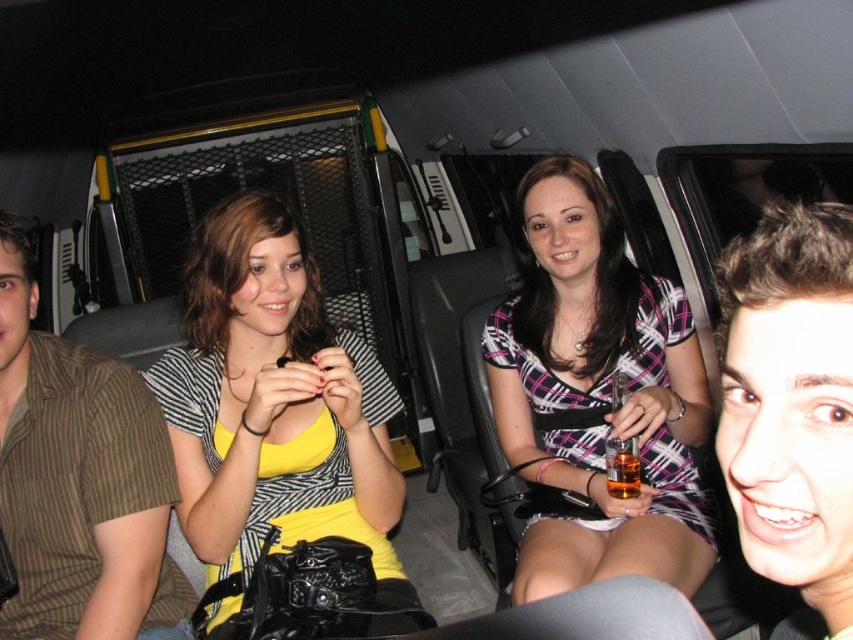
Question: Does plaid fabric dress at center have a lesser width compared to brown striped shirt at left?

Choices:
 (A) yes
 (B) no

Answer: (B)

Question: Which point is farther to the camera?

Choices:
 (A) (697, 529)
 (B) (631, 497)
 (C) (207, 497)

Answer: (A)

Question: Is brown striped shirt at left further to the viewer compared to translucent amber liquid at lower right?

Choices:
 (A) no
 (B) yes

Answer: (A)

Question: In this image, where is plaid fabric dress at center located relative to brown striped shirt at left?

Choices:
 (A) below
 (B) above

Answer: (B)

Question: Which of the following is the farthest from the observer?

Choices:
 (A) (552, 289)
 (B) (624, 456)
 (C) (158, 531)
 (D) (244, 342)

Answer: (A)

Question: Which point is closer to the camera?

Choices:
 (A) yellow fabric dress at center
 (B) translucent amber liquid at lower right

Answer: (A)